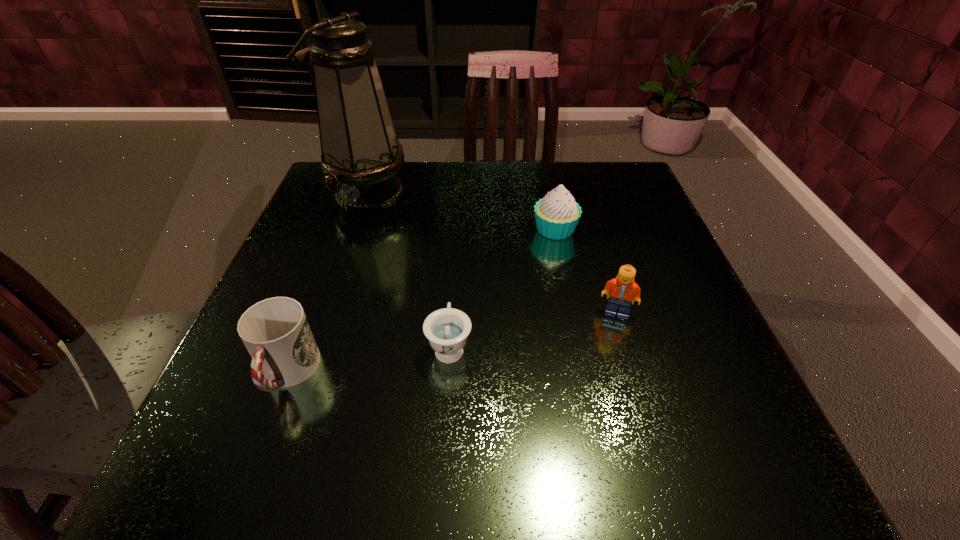
At what (x,y) coordinates should I click in order to perform the action: click on the tallest object. Please return your answer as a coordinate pair (x, y). Image resolution: width=960 pixels, height=540 pixels. Looking at the image, I should click on (360, 150).

I want to click on oil lamp, so click(360, 150).

You are a GUI agent. You are given a task and a screenshot of the screen. Output one action in this format:
    pyautogui.click(x=<x>, y=<y>)
    Task: Click on the second farthest object
    The width and height of the screenshot is (960, 540).
    Given the screenshot: What is the action you would take?
    pyautogui.click(x=557, y=214)

Find the location of `the third nearest object`. the third nearest object is located at coordinates (622, 289).

Find the location of a particular element. The width and height of the screenshot is (960, 540). cup is located at coordinates (275, 331).

Identify the location of the third object from left to right. (447, 329).

Find the location of `teacup`. teacup is located at coordinates (447, 329).

Find the location of a particular element. The image size is (960, 540). vacant space located 0.310m on the right of the tallest object is located at coordinates (537, 191).

Identify the location of vacant space located 0.070m on the back of the cupcake. The width and height of the screenshot is (960, 540). click(549, 199).

Locate an element on the screen. free point located on the front-facing side of the Lego is located at coordinates (631, 358).